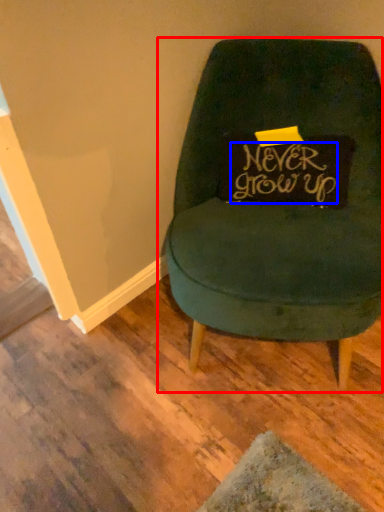
Question: Among these objects, which one is nearest to the camera, chair (highlighted by a red box) or writing (highlighted by a blue box)?

Choices:
 (A) chair
 (B) writing

Answer: (A)